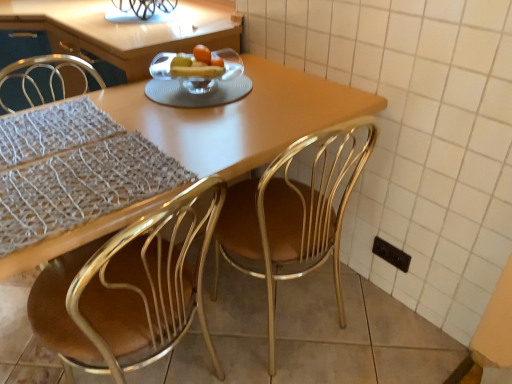
Question: From the image's perspective, is clear glass bowl at center on top of black plastic electric outlet at lower right?

Choices:
 (A) yes
 (B) no

Answer: (A)

Question: From a real-world perspective, is clear glass bowl at center below black plastic electric outlet at lower right?

Choices:
 (A) yes
 (B) no

Answer: (B)

Question: Can you confirm if clear glass bowl at center is positioned to the right of black plastic electric outlet at lower right?

Choices:
 (A) no
 (B) yes

Answer: (A)

Question: Is clear glass bowl at center touching black plastic electric outlet at lower right?

Choices:
 (A) no
 (B) yes

Answer: (A)

Question: From a real-world perspective, is clear glass bowl at center on black plastic electric outlet at lower right?

Choices:
 (A) no
 (B) yes

Answer: (B)

Question: Does clear glass bowl at center turn towards black plastic electric outlet at lower right?

Choices:
 (A) no
 (B) yes

Answer: (A)

Question: From the image's perspective, is black plastic electric outlet at lower right under metallic gold chair at center, the 1th chair in the right-to-left sequence?

Choices:
 (A) yes
 (B) no

Answer: (A)

Question: From a real-world perspective, is black plastic electric outlet at lower right beneath metallic gold chair at center, the 1th chair in the right-to-left sequence?

Choices:
 (A) yes
 (B) no

Answer: (A)

Question: Are black plastic electric outlet at lower right and metallic gold chair at center, which is counted as the 2th chair, starting from the left, making contact?

Choices:
 (A) yes
 (B) no

Answer: (B)

Question: Is black plastic electric outlet at lower right shorter than metallic gold chair at center, which is counted as the 2th chair, starting from the left?

Choices:
 (A) no
 (B) yes

Answer: (B)

Question: Is black plastic electric outlet at lower right oriented away from metallic gold chair at center, the 1th chair in the right-to-left sequence?

Choices:
 (A) yes
 (B) no

Answer: (B)

Question: From a real-world perspective, is black plastic electric outlet at lower right positioned over metallic gold chair at center, which is counted as the 2th chair, starting from the left, based on gravity?

Choices:
 (A) no
 (B) yes

Answer: (A)

Question: Is clear glass bowl at center smaller than metallic gold chair at center, the 1th chair in the right-to-left sequence?

Choices:
 (A) yes
 (B) no

Answer: (A)